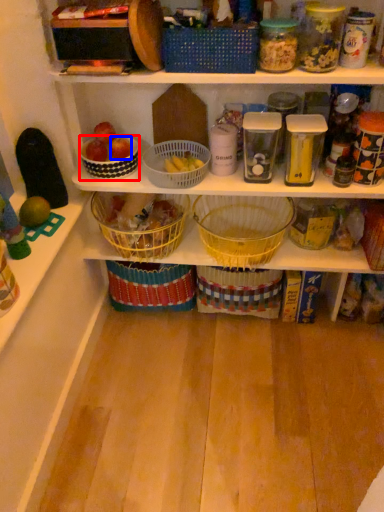
Question: Which object is closer to the camera taking this photo, bowl (highlighted by a red box) or apple (highlighted by a blue box)?

Choices:
 (A) bowl
 (B) apple

Answer: (A)